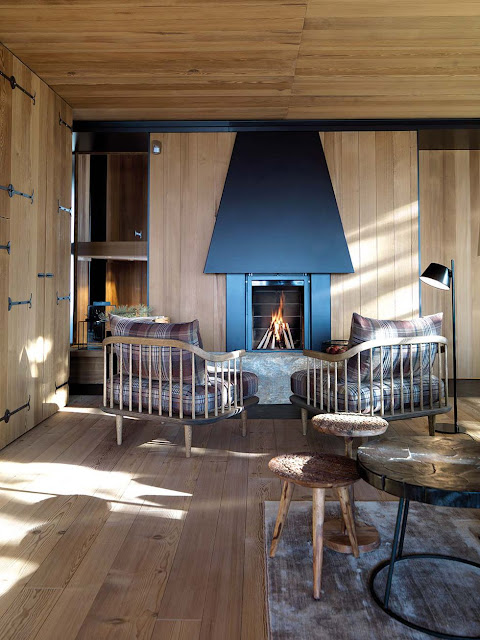
Find the location of `bar seat`. bar seat is located at coordinates (317, 472), (348, 420).